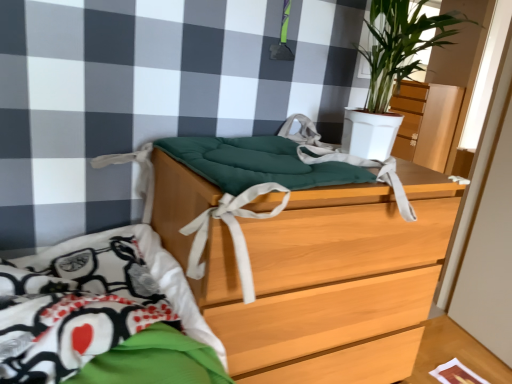
Question: From the image's perspective, is green matte plant at upper right located above or below matte wood dresser at upper right?

Choices:
 (A) above
 (B) below

Answer: (B)

Question: Considering the positions of point (367, 94) and point (423, 134), is point (367, 94) closer or farther from the camera than point (423, 134)?

Choices:
 (A) closer
 (B) farther

Answer: (A)

Question: Which object is positioned farthest from the matte wood dresser at upper right?

Choices:
 (A) wooden chest of drawers at center
 (B) green matte plant at upper right

Answer: (A)

Question: Considering the real-world distances, which object is closest to the green matte plant at upper right?

Choices:
 (A) matte wood dresser at upper right
 (B) wooden chest of drawers at center

Answer: (B)